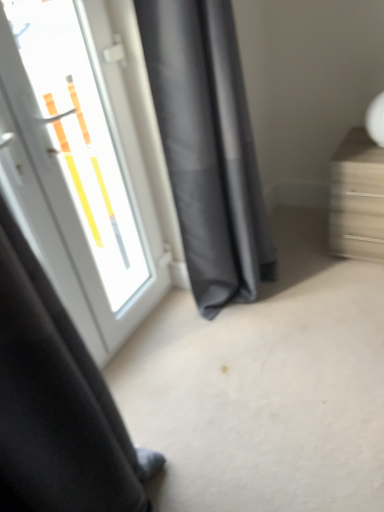
What do you see at coordinates (357, 198) in the screenshot?
I see `wooden drawer at right` at bounding box center [357, 198].

Where is `wooden drawer at right`? The image size is (384, 512). wooden drawer at right is located at coordinates (357, 198).

Considering the sizes of white glossy door at upper left and wooden drawer at right in the image, is white glossy door at upper left bigger or smaller than wooden drawer at right?

Considering their sizes, white glossy door at upper left takes up more space than wooden drawer at right.

Is white glossy door at upper left positioned behind wooden drawer at right?

No, it is not.

Find the location of `furniture that is under the white glossy door at upper left (from a real-world perspective)`. furniture that is under the white glossy door at upper left (from a real-world perspective) is located at coordinates (357, 198).

Which object is wider, wooden drawer at right or white glossy door at upper left?

wooden drawer at right.

In the scene shown: Which is behind, wooden drawer at right or white glossy door at upper left?

wooden drawer at right is further away from the camera.

From a real-world perspective, is wooden drawer at right beneath white glossy door at upper left?

Yes, from a real-world perspective, wooden drawer at right is below white glossy door at upper left.

Is wooden drawer at right facing away from white glossy door at upper left?

No.

Considering the sizes of dark gray fabric curtain at center and wooden drawer at right in the image, is dark gray fabric curtain at center taller or shorter than wooden drawer at right?

In the image, dark gray fabric curtain at center appears to be taller than wooden drawer at right.

Is dark gray fabric curtain at center to the left of wooden drawer at right from the viewer's perspective?

Indeed, dark gray fabric curtain at center is positioned on the left side of wooden drawer at right.

Can you confirm if dark gray fabric curtain at center is bigger than wooden drawer at right?

Yes, dark gray fabric curtain at center is bigger than wooden drawer at right.

Can you tell me how much dark gray fabric curtain at center and wooden drawer at right differ in facing direction?

The angular difference between dark gray fabric curtain at center and wooden drawer at right is 91.6 degrees.

Is white glossy door at upper left outside of dark gray fabric curtain at center?

Indeed, white glossy door at upper left is completely outside dark gray fabric curtain at center.

Who is bigger, white glossy door at upper left or dark gray fabric curtain at center?

dark gray fabric curtain at center.

What's the angular difference between white glossy door at upper left and dark gray fabric curtain at center's facing directions?

The angle between the facing direction of white glossy door at upper left and the facing direction of dark gray fabric curtain at center is 0.831 degrees.

Looking at this image, considering the sizes of objects white glossy door at upper left and dark gray fabric curtain at center in the image provided, who is wider, white glossy door at upper left or dark gray fabric curtain at center?

dark gray fabric curtain at center is wider.

Is wooden drawer at right positioned before dark gray fabric curtain at center?

No, the depth of wooden drawer at right is greater than that of dark gray fabric curtain at center.

Between point (377, 249) and point (156, 42), which one is positioned behind?

Positioned behind is point (377, 249).

From a real-world perspective, is wooden drawer at right under dark gray fabric curtain at center?

Yes, from a real-world perspective, wooden drawer at right is under dark gray fabric curtain at center.

Is wooden drawer at right oriented towards dark gray fabric curtain at center?

No, wooden drawer at right is not turned towards dark gray fabric curtain at center.

From their relative heights in the image, would you say dark gray fabric curtain at center is taller or shorter than white glossy door at upper left?

In the image, dark gray fabric curtain at center appears to be shorter than white glossy door at upper left.

Would you say dark gray fabric curtain at center is inside or outside white glossy door at upper left?

dark gray fabric curtain at center is located beyond the bounds of white glossy door at upper left.

How many degrees apart are the facing directions of dark gray fabric curtain at center and white glossy door at upper left?

There is a 0.831-degree angle between the facing directions of dark gray fabric curtain at center and white glossy door at upper left.

Considering the positions of objects dark gray fabric curtain at center and white glossy door at upper left in the image provided, who is behind, dark gray fabric curtain at center or white glossy door at upper left?

dark gray fabric curtain at center is further away from the camera.

You are a GUI agent. You are given a task and a screenshot of the screen. Output one action in this format:
    pyautogui.click(x=<x>, y=<y>)
    Task: Click on the furniture lying behind the white glossy door at upper left
    The width and height of the screenshot is (384, 512).
    Given the screenshot: What is the action you would take?
    pyautogui.click(x=357, y=198)

In order to click on furniture to the right of white glossy door at upper left in this screenshot , I will do coord(357,198).

From the image, which object appears to be farther from white glossy door at upper left, wooden drawer at right or dark gray fabric curtain at center?

→ wooden drawer at right.

Which object lies nearer to the anchor point dark gray fabric curtain at center, white glossy door at upper left or wooden drawer at right?

Among the two, white glossy door at upper left is located nearer to dark gray fabric curtain at center.

Based on their spatial positions, is dark gray fabric curtain at center or white glossy door at upper left further from wooden drawer at right?

Among the two, white glossy door at upper left is located further to wooden drawer at right.

When comparing their distances from white glossy door at upper left, does dark gray fabric curtain at center or wooden drawer at right seem further?

Among the two, wooden drawer at right is located further to white glossy door at upper left.

Which object lies nearer to the anchor point dark gray fabric curtain at center, wooden drawer at right or white glossy door at upper left?

white glossy door at upper left is positioned closer to the anchor dark gray fabric curtain at center.

Consider the image. Considering their positions, is white glossy door at upper left positioned further to wooden drawer at right than dark gray fabric curtain at center?

Based on the image, white glossy door at upper left appears to be further to wooden drawer at right.

The width and height of the screenshot is (384, 512). In order to click on curtain between white glossy door at upper left and wooden drawer at right in this screenshot , I will do `click(208, 147)`.